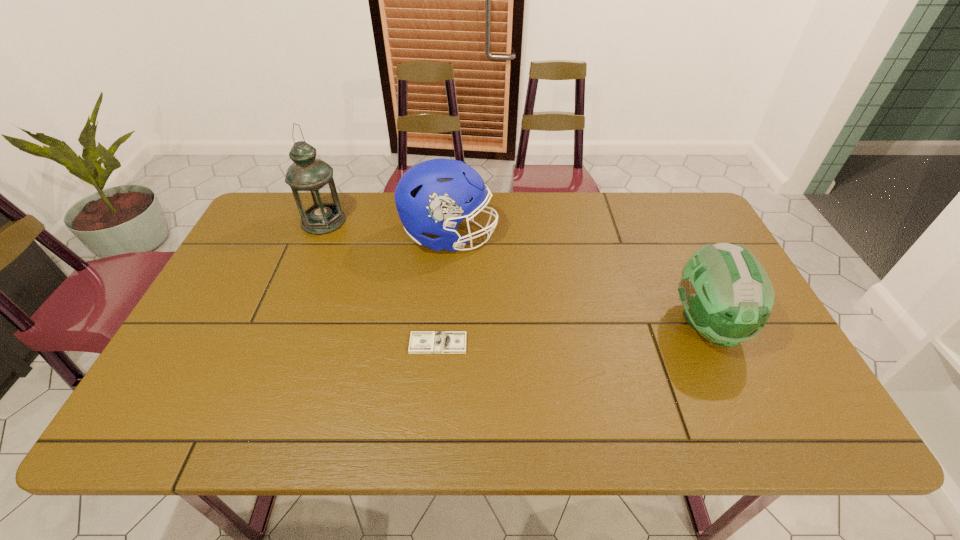
At what (x,y) coordinates should I click in order to perform the action: click on oil lamp that is at the far edge. Please return your answer as a coordinate pair (x, y). The image size is (960, 540). Looking at the image, I should click on (311, 180).

Where is `football helmet at the far edge`? football helmet at the far edge is located at coordinates (433, 196).

This screenshot has height=540, width=960. Identify the location of object located in the left edge section of the desktop. (311, 180).

Where is `object located at the right edge`? object located at the right edge is located at coordinates (727, 296).

Where is `object at the far left corner`? object at the far left corner is located at coordinates (311, 180).

You are a GUI agent. You are given a task and a screenshot of the screen. Output one action in this format:
    pyautogui.click(x=<x>, y=<y>)
    Task: Click on the free space at the far edge of the desktop
    The image size is (960, 540).
    Given the screenshot: What is the action you would take?
    pyautogui.click(x=357, y=208)

In the image, there is a desktop. Where is `vacant space at the near edge`? The height and width of the screenshot is (540, 960). vacant space at the near edge is located at coordinates (369, 436).

Image resolution: width=960 pixels, height=540 pixels. In order to click on vacant area at the far left corner in this screenshot , I will do coord(274,204).

Where is `free spot at the near left corner of the desktop`? The width and height of the screenshot is (960, 540). free spot at the near left corner of the desktop is located at coordinates (190, 428).

You are a GUI agent. You are given a task and a screenshot of the screen. Output one action in this format:
    pyautogui.click(x=<x>, y=<y>)
    Task: Click on the empty space that is in between the oil lamp and the third tallest object
    Image resolution: width=960 pixels, height=540 pixels.
    Given the screenshot: What is the action you would take?
    pyautogui.click(x=515, y=273)